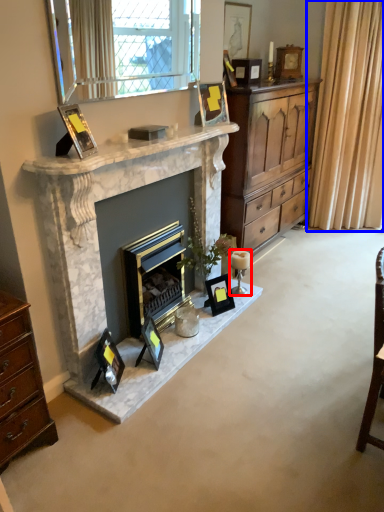
Question: Which object appears closest to the camera in this image, candle holder (highlighted by a red box) or curtain (highlighted by a blue box)?

Choices:
 (A) candle holder
 (B) curtain

Answer: (A)